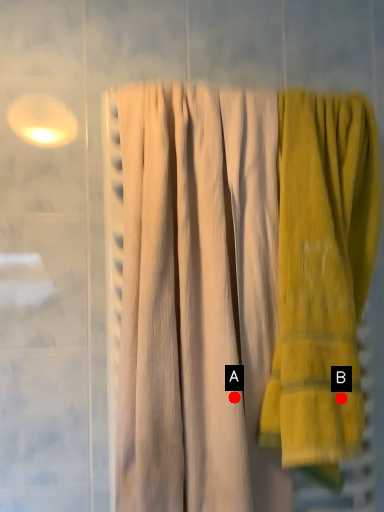
Question: Two points are circled on the image, labeled by A and B beside each circle. Among these points, which one is nearest to the camera?

Choices:
 (A) A is closer
 (B) B is closer

Answer: (B)